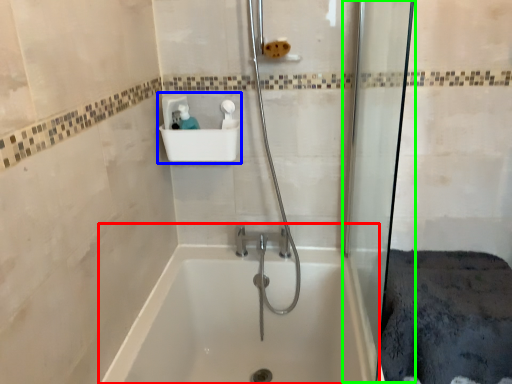
Question: Considering the real-world distances, which object is farthest from bathtub (highlighted by a red box)? sink (highlighted by a blue box) or shower door (highlighted by a green box)?

Choices:
 (A) sink
 (B) shower door

Answer: (A)